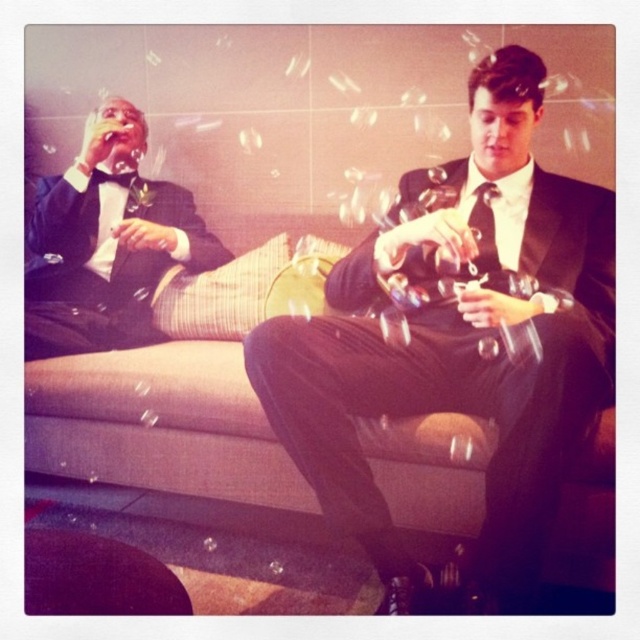
Which of these two, matte black suit at center or matte black tuxedo at left, stands taller?

matte black suit at center is taller.

From the picture: Does matte black suit at center appear over matte black tuxedo at left?

Incorrect, matte black suit at center is not positioned above matte black tuxedo at left.

Does point (333, 368) come in front of point (168, 180)?

Yes, it is.

Find the location of `matte black suit at center`. matte black suit at center is located at coordinates (460, 339).

Based on the photo, does beige fabric couch at center appear on the left side of matte black tuxedo at left?

No, beige fabric couch at center is not to the left of matte black tuxedo at left.

Does beige fabric couch at center appear under matte black tuxedo at left?

Indeed, beige fabric couch at center is positioned under matte black tuxedo at left.

Locate an element on the screen. The image size is (640, 640). beige fabric couch at center is located at coordinates (160, 424).

Based on the photo, can you confirm if matte black suit at center is smaller than beige fabric couch at center?

Yes, matte black suit at center is smaller than beige fabric couch at center.

Who is more distant from viewer, (540, 272) or (132, 365)?

The point (132, 365) is more distant.

The height and width of the screenshot is (640, 640). Identify the location of matte black suit at center. (460, 339).